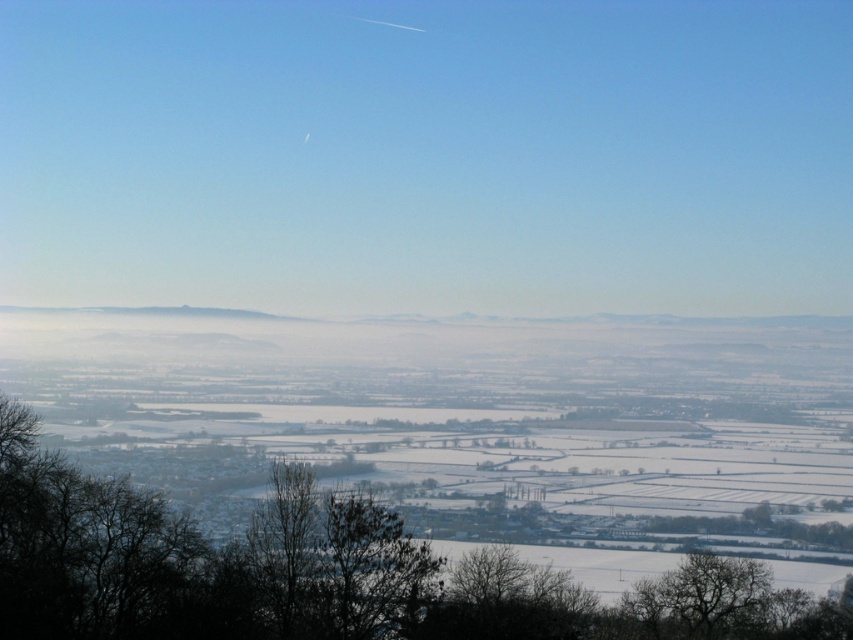
Between silhouette bare tree at lower center and bare branches at lower right, which one has more height?

silhouette bare tree at lower center is taller.

Find the location of a particular element. Image resolution: width=853 pixels, height=640 pixels. silhouette bare tree at lower center is located at coordinates (323, 572).

Between point (3, 419) and point (694, 589), which one is positioned behind?

The point (694, 589) is behind.

Where is `silhouette bare tree at lower center`? This screenshot has width=853, height=640. silhouette bare tree at lower center is located at coordinates (323, 572).